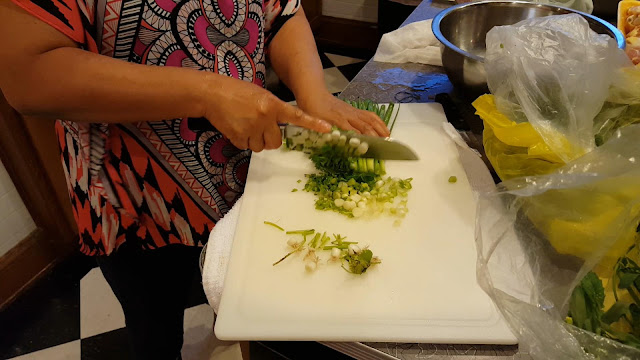
I want to click on white cutting board, so click(x=412, y=305).